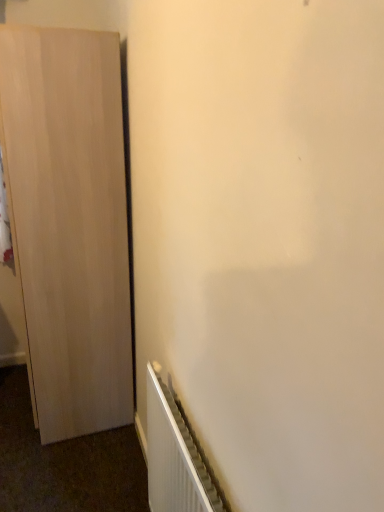
Question: From a real-world perspective, is white metallic radiator at lower right on light wood cupboard at left?

Choices:
 (A) no
 (B) yes

Answer: (A)

Question: Is white metallic radiator at lower right turned away from light wood cupboard at left?

Choices:
 (A) no
 (B) yes

Answer: (A)

Question: Is the position of white metallic radiator at lower right more distant than that of light wood cupboard at left?

Choices:
 (A) no
 (B) yes

Answer: (A)

Question: From the image's perspective, is white metallic radiator at lower right located above light wood cupboard at left?

Choices:
 (A) yes
 (B) no

Answer: (B)

Question: Is white metallic radiator at lower right to the right of light wood cupboard at left from the viewer's perspective?

Choices:
 (A) no
 (B) yes

Answer: (B)

Question: Considering the relative sizes of white metallic radiator at lower right and light wood cupboard at left in the image provided, is white metallic radiator at lower right taller than light wood cupboard at left?

Choices:
 (A) yes
 (B) no

Answer: (B)

Question: Does light wood cupboard at left turn towards white metallic radiator at lower right?

Choices:
 (A) no
 (B) yes

Answer: (A)

Question: From the image's perspective, is light wood cupboard at left on white metallic radiator at lower right?

Choices:
 (A) yes
 (B) no

Answer: (A)

Question: Is the position of light wood cupboard at left less distant than that of white metallic radiator at lower right?

Choices:
 (A) yes
 (B) no

Answer: (B)

Question: Can you confirm if light wood cupboard at left is wider than white metallic radiator at lower right?

Choices:
 (A) yes
 (B) no

Answer: (A)

Question: Considering the relative positions of light wood cupboard at left and white metallic radiator at lower right in the image provided, is light wood cupboard at left to the right of white metallic radiator at lower right from the viewer's perspective?

Choices:
 (A) no
 (B) yes

Answer: (A)

Question: Does light wood cupboard at left have a smaller size compared to white metallic radiator at lower right?

Choices:
 (A) no
 (B) yes

Answer: (A)

Question: Is point (59, 159) closer or farther from the camera than point (208, 494)?

Choices:
 (A) farther
 (B) closer

Answer: (A)